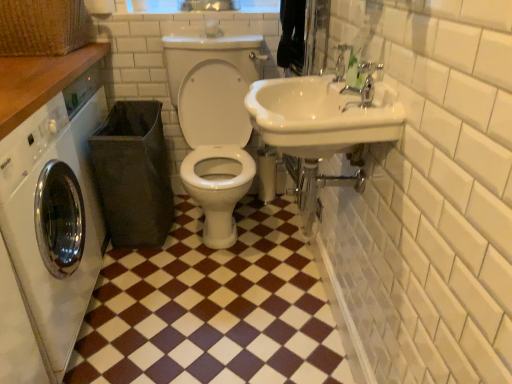
Question: Is point (167, 253) closer or farther from the camera than point (22, 278)?

Choices:
 (A) closer
 (B) farther

Answer: (B)

Question: Is brown glossy tile at lower left taller or shorter than white glossy washing machine at left?

Choices:
 (A) tall
 (B) short

Answer: (B)

Question: Based on their relative distances, which object is nearer to the wooden counter at upper left?

Choices:
 (A) white glossy toilet at center
 (B) white glossy washing machine at left
 (C) brown glossy tile at lower left
 (D) burlap basket at upper left
 (E) white glossy sink at upper right

Answer: (D)

Question: Estimate the real-world distances between objects in this image. Which object is closer to the white glossy washing machine at left?

Choices:
 (A) white matte toilet paper at upper center
 (B) white glossy toilet at center
 (C) brown glossy tile at lower left
 (D) white glossy sink at upper right
 (E) silver metallic faucet at upper right

Answer: (C)